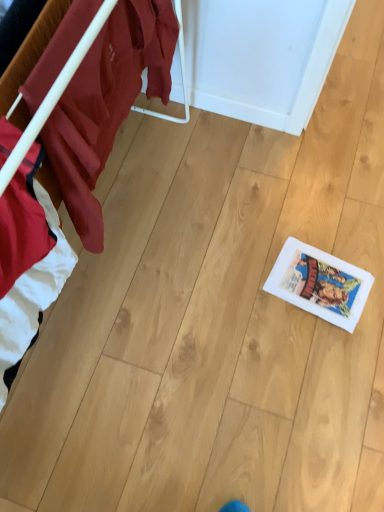
Question: From the image's perspective, relative to white paper comic book at lower right, is wooden floor at lower right above or below?

Choices:
 (A) above
 (B) below

Answer: (A)

Question: Is point (49, 258) positioned closer to the camera than point (289, 296)?

Choices:
 (A) closer
 (B) farther

Answer: (A)

Question: Looking at the image, does wooden floor at lower right seem bigger or smaller compared to white paper comic book at lower right?

Choices:
 (A) small
 (B) big

Answer: (B)

Question: In the image, is white paper comic book at lower right on the left side or the right side of wooden floor at lower right?

Choices:
 (A) right
 (B) left

Answer: (A)

Question: From a real-world perspective, is white paper comic book at lower right above or below wooden floor at lower right?

Choices:
 (A) above
 (B) below

Answer: (B)

Question: From the image's perspective, is white paper comic book at lower right positioned above or below wooden floor at lower right?

Choices:
 (A) below
 (B) above

Answer: (A)

Question: In terms of size, does white paper comic book at lower right appear bigger or smaller than wooden floor at lower right?

Choices:
 (A) big
 (B) small

Answer: (B)